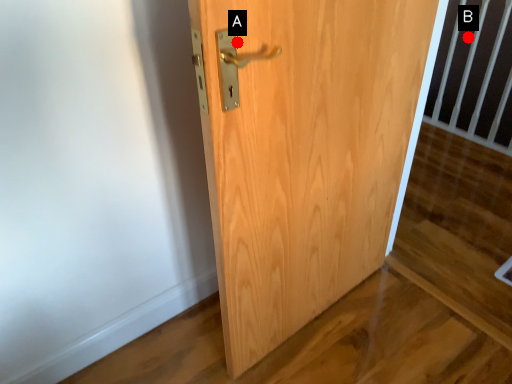
Question: Two points are circled on the image, labeled by A and B beside each circle. Which point appears farthest from the camera in this image?

Choices:
 (A) A is further
 (B) B is further

Answer: (B)